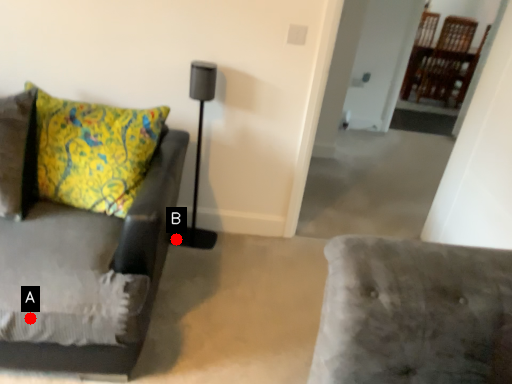
Question: Two points are circled on the image, labeled by A and B beside each circle. Which point is farther from the camera taking this photo?

Choices:
 (A) A is further
 (B) B is further

Answer: (B)